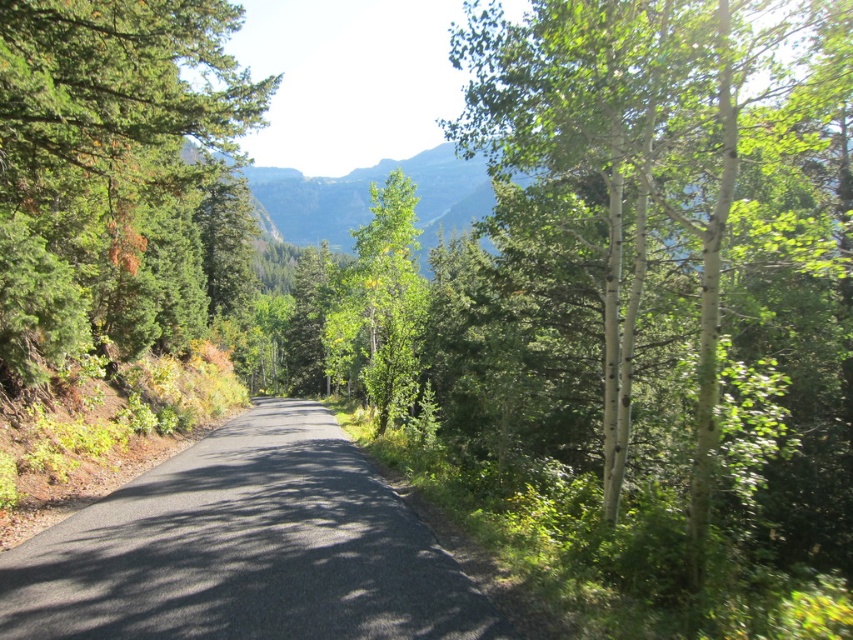
Question: Which point is farther to the camera?

Choices:
 (A) (395, 403)
 (B) (135, 260)

Answer: (B)

Question: Can you confirm if white bark tree at right is positioned below black asphalt road at center?

Choices:
 (A) no
 (B) yes

Answer: (A)

Question: Which object appears farthest from the camera in this image?

Choices:
 (A) black asphalt road at center
 (B) green matte tree at left
 (C) green leafy tree at center
 (D) white bark tree at right

Answer: (C)

Question: Does green matte tree at left come in front of black asphalt road at center?

Choices:
 (A) yes
 (B) no

Answer: (B)

Question: Can you confirm if green matte tree at left is smaller than green leafy tree at center?

Choices:
 (A) yes
 (B) no

Answer: (B)

Question: Which is nearer to the white bark tree at right?

Choices:
 (A) green leafy tree at center
 (B) green matte tree at left
 (C) black asphalt road at center

Answer: (B)